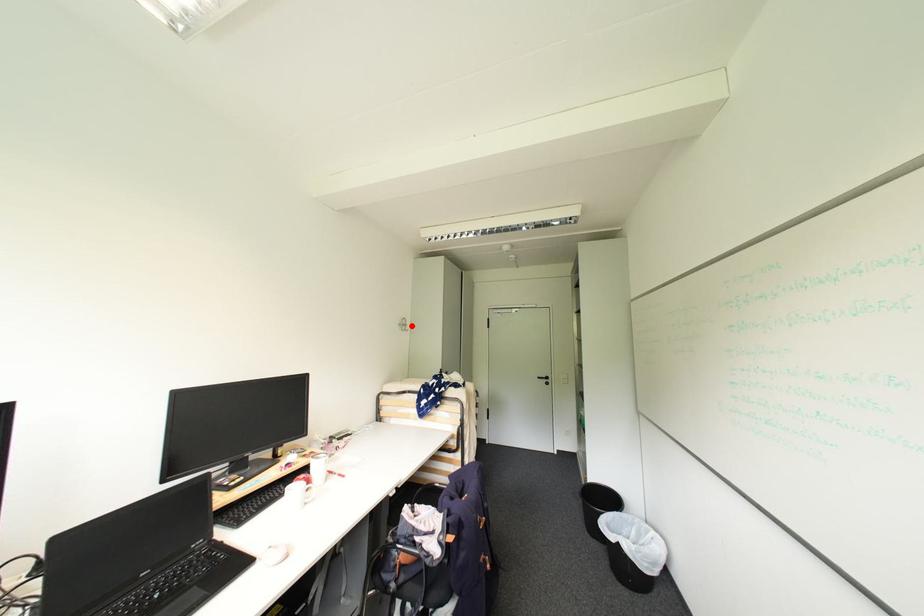
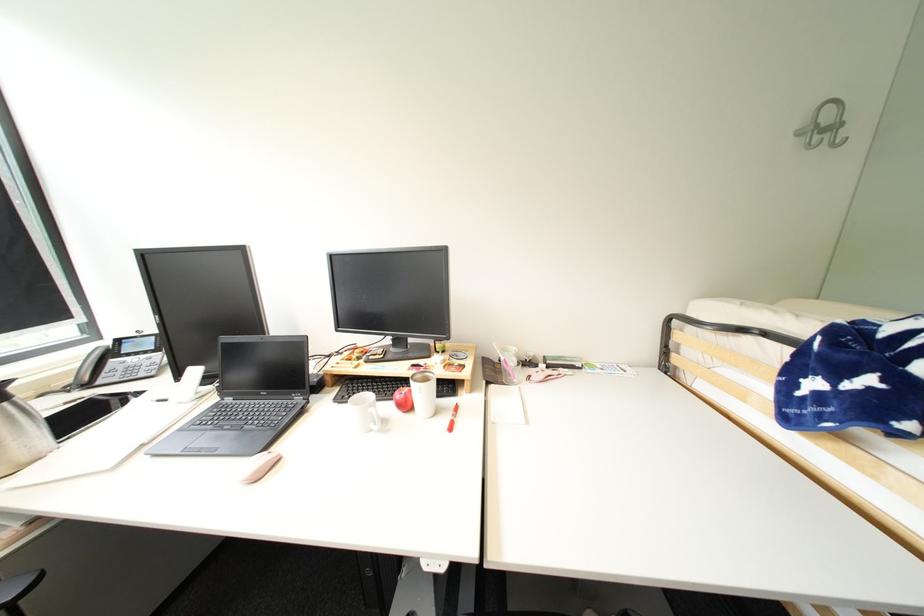
Where in the second image is the point corresponding to the highlighted location from the first image?

(841, 128)